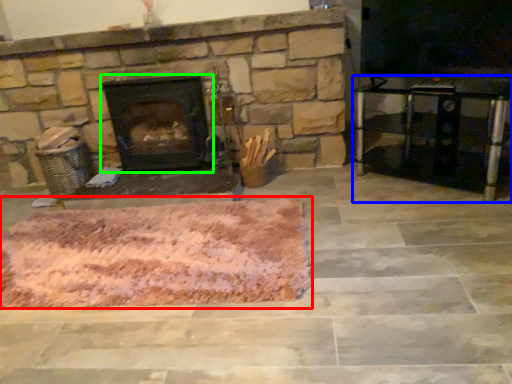
Question: Which object is the closest to the mat (highlighted by a red box)? Choose among these: entertainment center (highlighted by a blue box) or wood burning stove (highlighted by a green box).

Choices:
 (A) entertainment center
 (B) wood burning stove

Answer: (B)